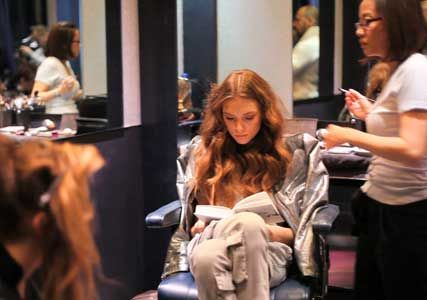
Locate an element on the screen. This screenshot has height=300, width=427. book is located at coordinates (255, 207), (217, 211).